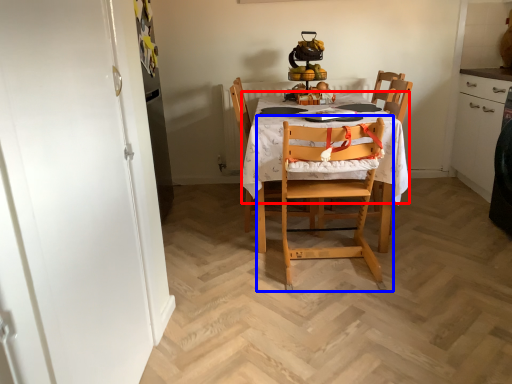
Question: Which object appears farthest to the camera in this image, tablecloth (highlighted by a red box) or chair (highlighted by a blue box)?

Choices:
 (A) tablecloth
 (B) chair

Answer: (A)